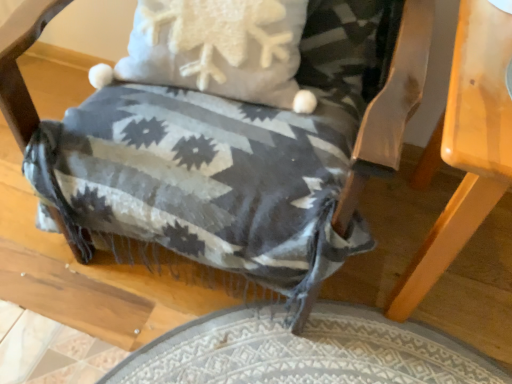
Find the location of `woven fabric blanket at center`. woven fabric blanket at center is located at coordinates (231, 151).

What do you see at coordinates (231, 151) in the screenshot? I see `woven fabric blanket at center` at bounding box center [231, 151].

What is the approximate width of woven fabric blanket at center?

woven fabric blanket at center is 28.32 inches in width.

Find the location of `light brown wooden table at lower right`. light brown wooden table at lower right is located at coordinates (467, 146).

The width and height of the screenshot is (512, 384). What do you see at coordinates (467, 146) in the screenshot?
I see `light brown wooden table at lower right` at bounding box center [467, 146].

Identify the location of woven fabric blanket at center. This screenshot has width=512, height=384. (231, 151).

Is woven fabric blanket at center to the right of light brown wooden table at lower right from the viewer's perspective?

Incorrect, woven fabric blanket at center is not on the right side of light brown wooden table at lower right.

Which object is more forward, woven fabric blanket at center or light brown wooden table at lower right?

woven fabric blanket at center is in front.

Considering the points (240, 270) and (446, 111), which point is behind, point (240, 270) or point (446, 111)?

The point (446, 111) is farther from the camera.

From the image's perspective, is woven fabric blanket at center on top of light brown wooden table at lower right?

Correct, woven fabric blanket at center appears higher than light brown wooden table at lower right in the image.

From a real-world perspective, which object rests below the other?

light brown wooden table at lower right, from a real-world perspective.

Which object is wider, woven fabric blanket at center or light brown wooden table at lower right?

With larger width is woven fabric blanket at center.

Who is taller, woven fabric blanket at center or light brown wooden table at lower right?

woven fabric blanket at center is taller.

Considering the sizes of woven fabric blanket at center and light brown wooden table at lower right in the image, is woven fabric blanket at center bigger or smaller than light brown wooden table at lower right?

In the image, woven fabric blanket at center appears to be larger than light brown wooden table at lower right.

Is woven fabric blanket at center not within light brown wooden table at lower right?

Yes, woven fabric blanket at center is outside of light brown wooden table at lower right.

Can you see woven fabric blanket at center touching light brown wooden table at lower right?

No.

Looking at this image, could you tell me if woven fabric blanket at center is facing light brown wooden table at lower right?

No, woven fabric blanket at center is not facing towards light brown wooden table at lower right.

What's the angular difference between woven fabric blanket at center and light brown wooden table at lower right's facing directions?

0.455 degrees separate the facing orientations of woven fabric blanket at center and light brown wooden table at lower right.

You are a GUI agent. You are given a task and a screenshot of the screen. Output one action in this format:
    pyautogui.click(x=<x>, y=<y>)
    Task: Click on the chair lying in front of the light brown wooden table at lower right
    
    Given the screenshot: What is the action you would take?
    pyautogui.click(x=231, y=151)

Visually, is light brown wooden table at lower right positioned to the left or to the right of woven fabric blanket at center?

From the image, it's evident that light brown wooden table at lower right is to the right of woven fabric blanket at center.

Is light brown wooden table at lower right further to camera compared to woven fabric blanket at center?

Yes, light brown wooden table at lower right is further from the viewer.

Which is behind, point (451, 227) or point (399, 55)?

The point (451, 227) is more distant.

From the image's perspective, which is below, light brown wooden table at lower right or woven fabric blanket at center?

From the image's view, light brown wooden table at lower right is below.

From a real-world perspective, is light brown wooden table at lower right on top of woven fabric blanket at center?

Incorrect, from a real-world perspective, light brown wooden table at lower right is lower than woven fabric blanket at center.

Between light brown wooden table at lower right and woven fabric blanket at center, which one has smaller width?

Thinner between the two is light brown wooden table at lower right.

Based on the photo, does light brown wooden table at lower right have a greater height compared to woven fabric blanket at center?

Incorrect, the height of light brown wooden table at lower right is not larger of that of woven fabric blanket at center.

Considering the relative sizes of light brown wooden table at lower right and woven fabric blanket at center in the image provided, is light brown wooden table at lower right bigger than woven fabric blanket at center?

No.

Is light brown wooden table at lower right located outside woven fabric blanket at center?

Yes, light brown wooden table at lower right is located beyond the bounds of woven fabric blanket at center.

Is light brown wooden table at lower right not near woven fabric blanket at center?

No, there isn't a large distance between light brown wooden table at lower right and woven fabric blanket at center.

Is light brown wooden table at lower right oriented towards woven fabric blanket at center?

No, light brown wooden table at lower right is not turned towards woven fabric blanket at center.

How much distance is there between light brown wooden table at lower right and woven fabric blanket at center?

The distance of light brown wooden table at lower right from woven fabric blanket at center is 11.17 inches.

In the image, there is a light brown wooden table at lower right. Where is `chair above it (from the image's perspective)`? Image resolution: width=512 pixels, height=384 pixels. chair above it (from the image's perspective) is located at coordinates (231, 151).

Where is `table behind the woven fabric blanket at center`? The image size is (512, 384). table behind the woven fabric blanket at center is located at coordinates (467, 146).

Image resolution: width=512 pixels, height=384 pixels. What are the coordinates of `chair that is above the light brown wooden table at lower right (from a real-world perspective)` in the screenshot? It's located at coord(231,151).